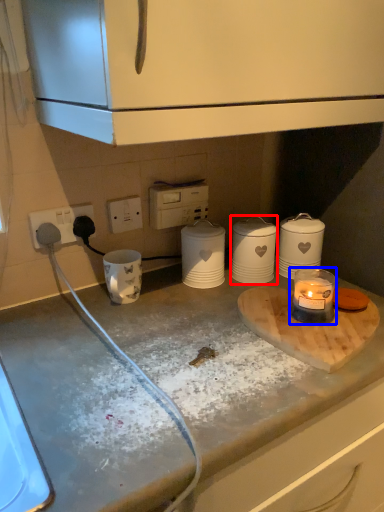
Question: Among these objects, which one is farthest to the camera, kitchen appliance (highlighted by a red box) or candle holder (highlighted by a blue box)?

Choices:
 (A) kitchen appliance
 (B) candle holder

Answer: (A)